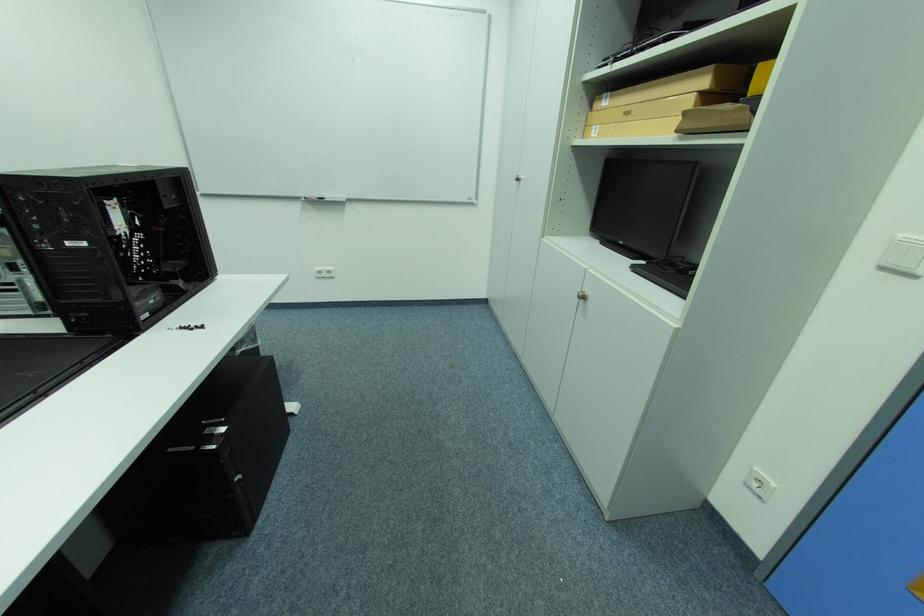
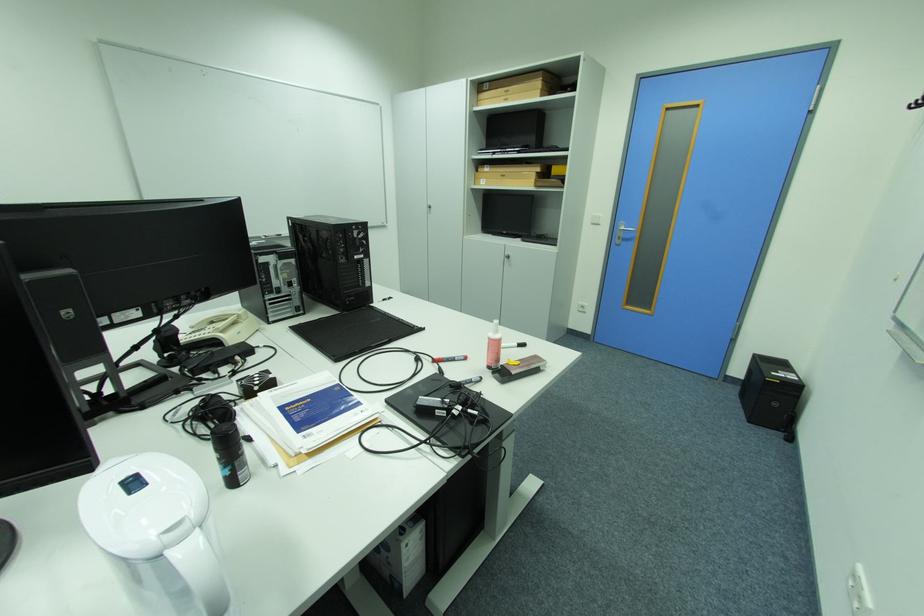
Locate, in the second image, the point that corresponds to point (590, 298) in the first image.

(516, 257)